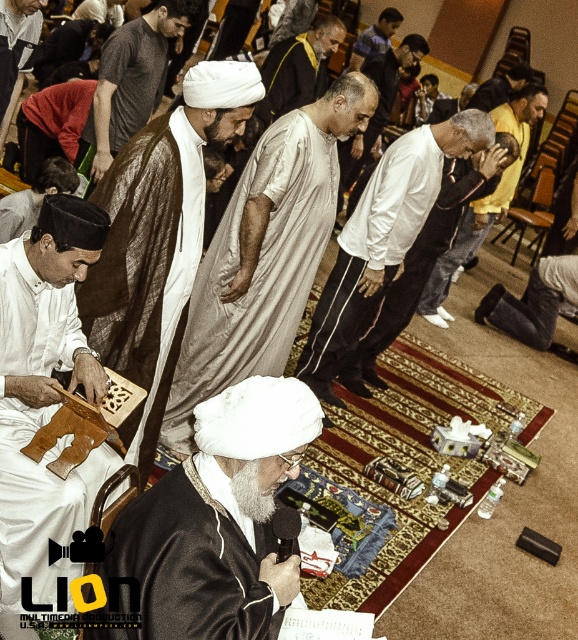
Question: Which of these objects is positioned farthest from the white matte turban at center?

Choices:
 (A) white cotton shirt at center
 (B) matte white robe at center

Answer: (A)

Question: Which object appears closest to the camera in this image?

Choices:
 (A) white matte turban at center
 (B) white matte cloth at center

Answer: (A)

Question: Considering the relative positions of matte brown wooden prayer board at left and white satin robe at center in the image provided, where is matte brown wooden prayer board at left located with respect to white satin robe at center?

Choices:
 (A) below
 (B) above

Answer: (A)

Question: Is white matte turban at center positioned in front of white cotton shirt at center?

Choices:
 (A) no
 (B) yes

Answer: (B)

Question: Is the position of white matte turban at center more distant than that of dark gray t-shirt at center?

Choices:
 (A) no
 (B) yes

Answer: (A)

Question: Which of the following is the closest to the observer?

Choices:
 (A) (5, 212)
 (B) (380, 196)

Answer: (A)